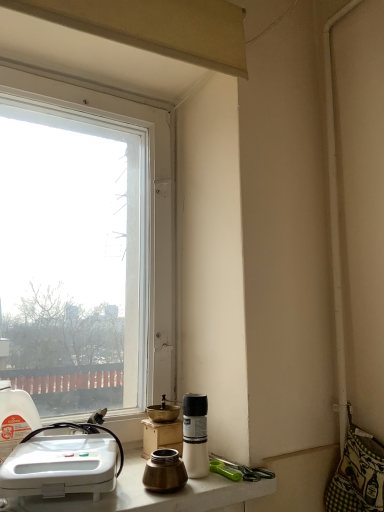
Where is `free space in front of gold matte grinder at center`? The image size is (384, 512). free space in front of gold matte grinder at center is located at coordinates (142, 483).